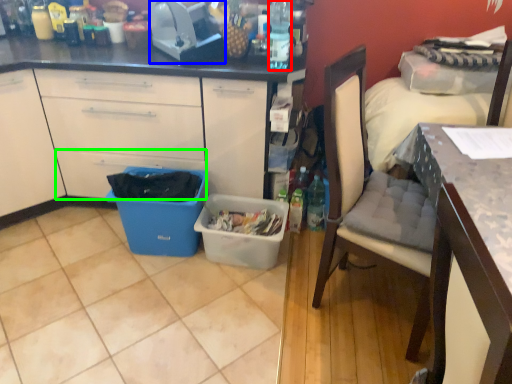
Question: Considering the real-world distances, which object is farthest from bottle (highlighted by a red box)? toaster (highlighted by a blue box) or drawer (highlighted by a green box)?

Choices:
 (A) toaster
 (B) drawer

Answer: (B)